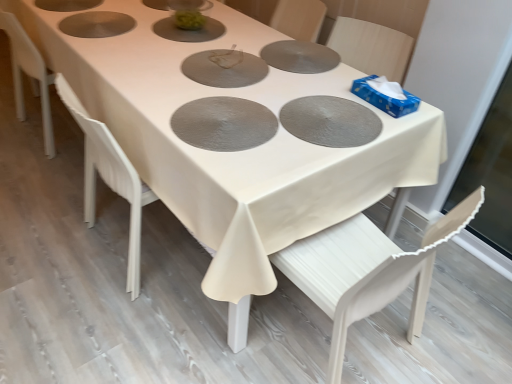
Locate an element on the screen. This screenshot has width=512, height=384. vacant space in textured silver pizza pan at center, arranged as the first pizza pan when ordered from the bottom (from a real-world perspective) is located at coordinates (225, 123).